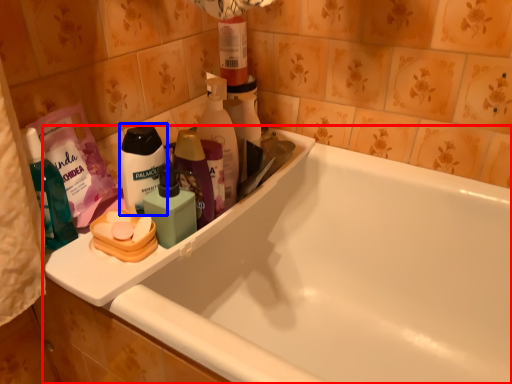
Question: Which object appears closest to the camera in this image, bathtub (highlighted by a red box) or personal care (highlighted by a blue box)?

Choices:
 (A) bathtub
 (B) personal care

Answer: (A)